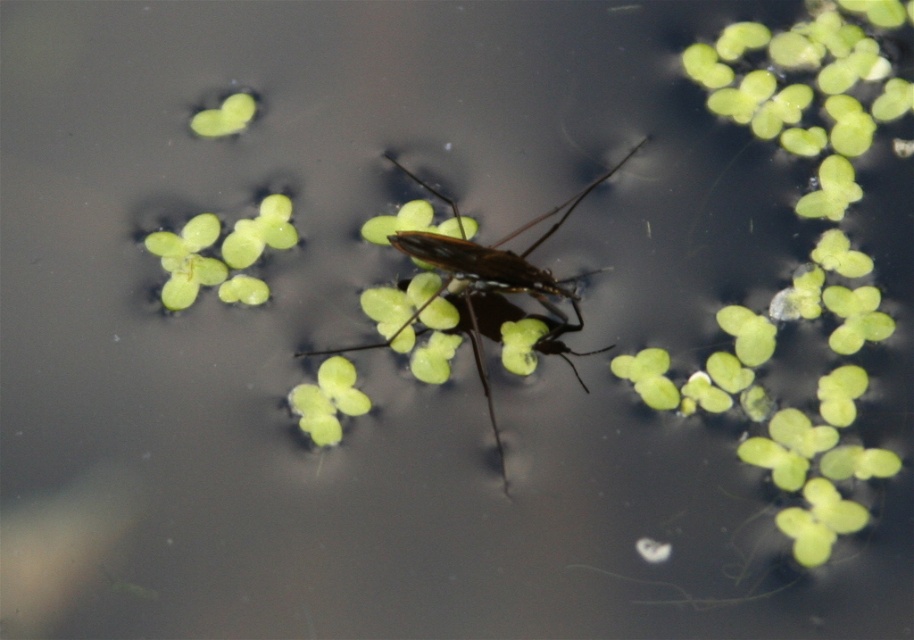
Question: Can you confirm if green leafy plant at upper left is positioned above green leafy at upper left?

Choices:
 (A) yes
 (B) no

Answer: (B)

Question: Which point appears closest to the camera in this image?

Choices:
 (A) (462, 256)
 (B) (210, 116)
 (C) (316, 444)

Answer: (C)

Question: Does translucent brown insect at center appear on the left side of green leafy plant at upper left?

Choices:
 (A) no
 (B) yes

Answer: (A)

Question: Is translucent brown insect at center wider than green leafy plant at upper left?

Choices:
 (A) yes
 (B) no

Answer: (A)

Question: Which point appears closest to the camera in this image?

Choices:
 (A) (166, 252)
 (B) (530, 285)
 (C) (315, 444)
 (D) (224, 129)

Answer: (C)

Question: Which of the following is the farthest from the observer?

Choices:
 (A) green leafy plant at upper left
 (B) translucent brown insect at center
 (C) green matte leaf at center

Answer: (A)